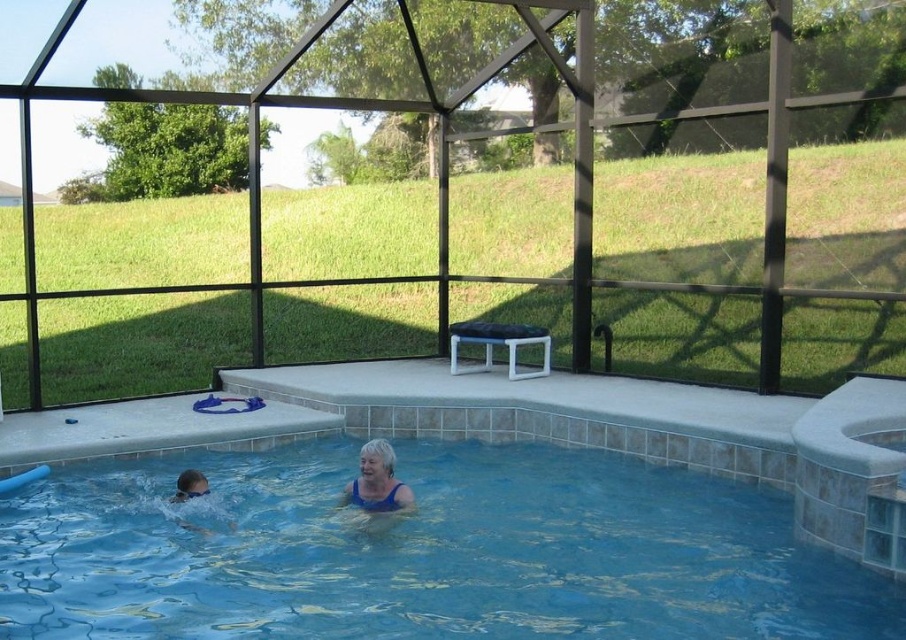
Can you confirm if blue fabric person at center is bigger than smooth blue swim cap at lower left?

Yes, blue fabric person at center is bigger than smooth blue swim cap at lower left.

Is blue fabric person at center to the right of smooth blue swim cap at lower left from the viewer's perspective?

Indeed, blue fabric person at center is positioned on the right side of smooth blue swim cap at lower left.

Does point (352, 492) come farther from viewer compared to point (182, 472)?

Yes.

Locate an element on the screen. The height and width of the screenshot is (640, 906). blue fabric person at center is located at coordinates (377, 481).

Is blue glossy water at center shorter than smooth blue swim cap at lower left?

No.

Does point (25, 580) lie in front of point (181, 497)?

Yes, it is in front of point (181, 497).

This screenshot has height=640, width=906. Identify the location of blue glossy water at center. (423, 552).

Does point (307, 513) come in front of point (342, 497)?

No, it is not.

Who is shorter, blue glossy water at center or blue fabric person at center?

blue glossy water at center

Image resolution: width=906 pixels, height=640 pixels. Describe the element at coordinates (423, 552) in the screenshot. I see `blue glossy water at center` at that location.

Locate an element on the screen. This screenshot has width=906, height=640. blue glossy water at center is located at coordinates (423, 552).